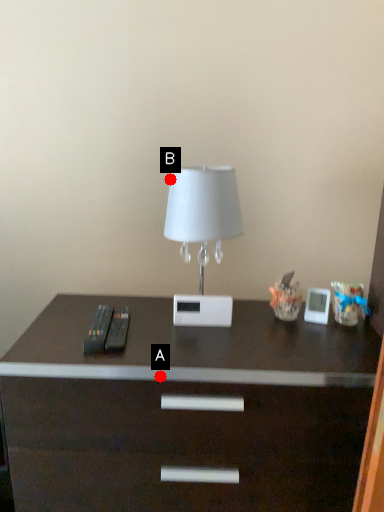
Question: Two points are circled on the image, labeled by A and B beside each circle. Among these points, which one is farthest from the camera?

Choices:
 (A) A is further
 (B) B is further

Answer: (B)